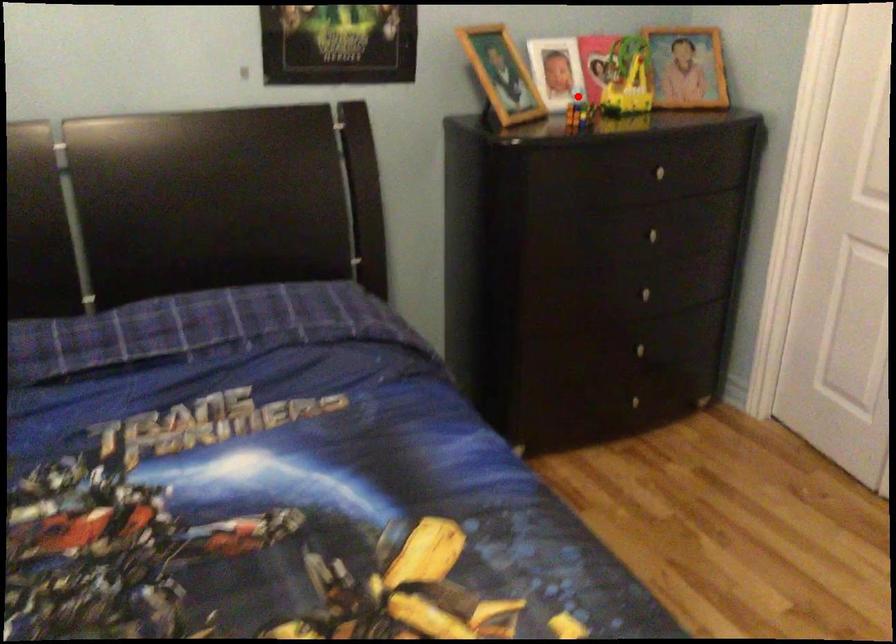
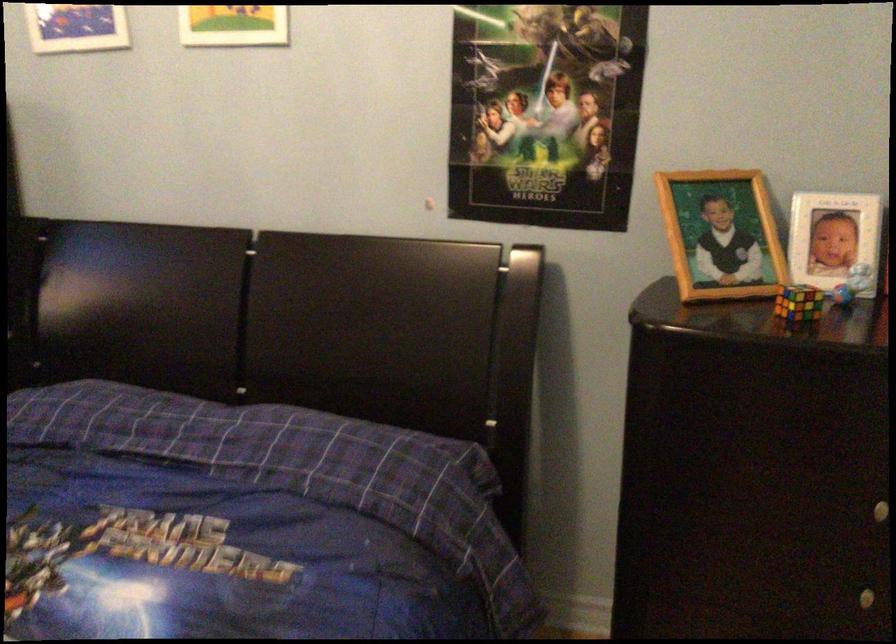
In the second image, find the point that corresponds to the highlighted location in the first image.

(851, 283)